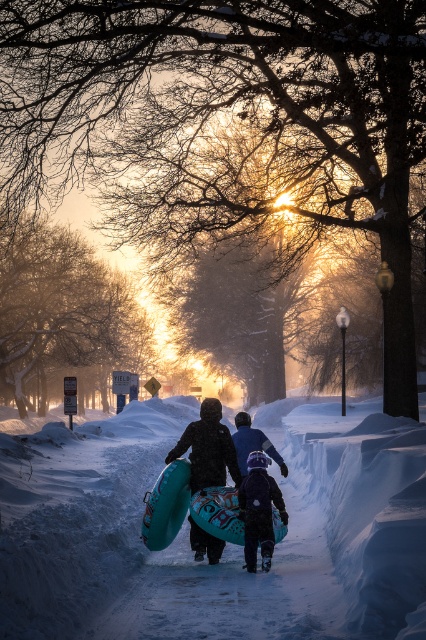
Is white fluffy snow at center thinner than teal rubber tube at center?

No.

Which is more to the right, white fluffy snow at center or teal rubber tube at center?

Positioned to the right is white fluffy snow at center.

Which is behind, point (66, 602) or point (199, 458)?

Positioned behind is point (199, 458).

The height and width of the screenshot is (640, 426). Find the location of `white fluffy snow at center`. white fluffy snow at center is located at coordinates (226, 547).

Can you confirm if teal rubber tube at center is positioned to the left of dark blue snowsuit at center?

Indeed, teal rubber tube at center is positioned on the left side of dark blue snowsuit at center.

Between teal rubber tube at center and dark blue snowsuit at center, which one appears on the right side from the viewer's perspective?

From the viewer's perspective, dark blue snowsuit at center appears more on the right side.

Where is `teal rubber tube at center`? This screenshot has width=426, height=640. teal rubber tube at center is located at coordinates (207, 449).

Is dark blue snowsuit at center smaller than blue rubber tube at center?

Yes.

This screenshot has width=426, height=640. Describe the element at coordinates (259, 509) in the screenshot. I see `dark blue snowsuit at center` at that location.

Where is `dark blue snowsuit at center`? This screenshot has width=426, height=640. dark blue snowsuit at center is located at coordinates (259, 509).